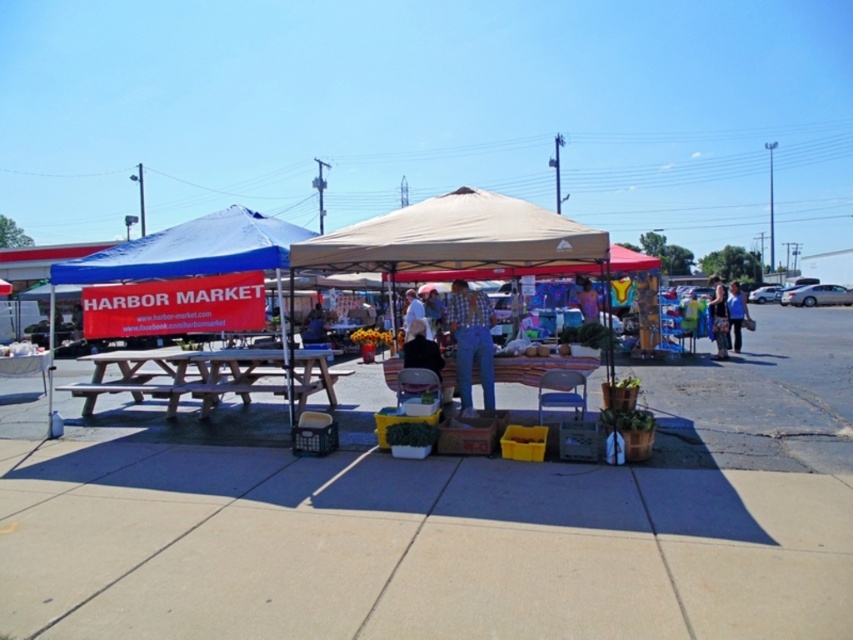
Question: Is tan fabric canopy at center to the right of denim jacket at lower right from the viewer's perspective?

Choices:
 (A) no
 (B) yes

Answer: (A)

Question: Is tan fabric canopy at center thinner than light brown wooden picnic table at left?

Choices:
 (A) yes
 (B) no

Answer: (B)

Question: Does tan fabric canopy at center have a smaller size compared to light brown wooden picnic table at left?

Choices:
 (A) no
 (B) yes

Answer: (A)

Question: Which of the following is the closest to the observer?

Choices:
 (A) (325, 381)
 (B) (712, 280)
 (C) (125, 269)

Answer: (C)

Question: Which of the following is the closest to the observer?

Choices:
 (A) (418, 312)
 (B) (718, 312)

Answer: (A)

Question: Which point appears closest to the camera in this image?

Choices:
 (A) (460, 323)
 (B) (244, 358)
 (C) (718, 300)

Answer: (A)